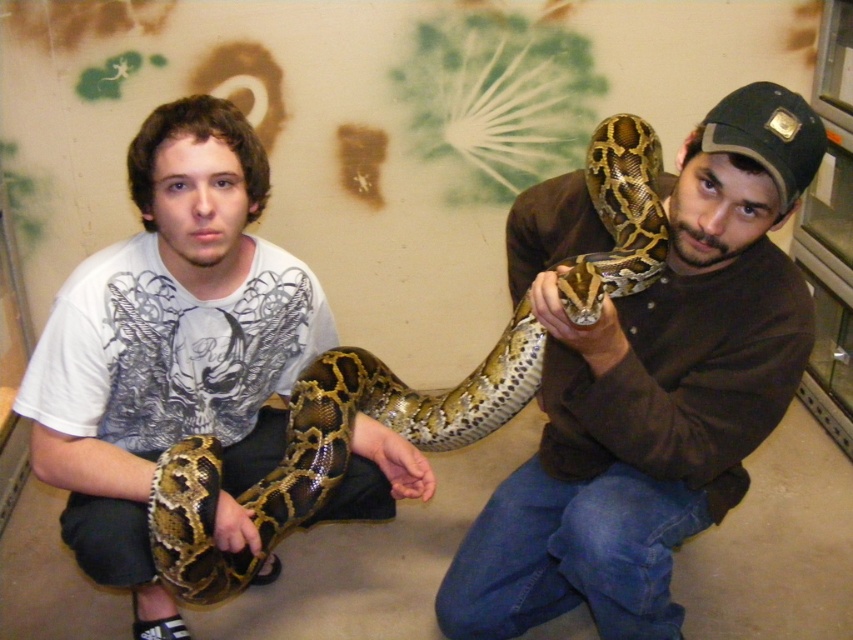
Is brown leather jacket at center thinner than shiny brown snake at center?

Yes.

Is point (627, 560) farther from viewer compared to point (200, 509)?

Yes.

Locate an element on the screen. brown leather jacket at center is located at coordinates (646, 385).

Which is in front, point (682, 240) or point (80, 269)?

Point (682, 240) is in front.

Is brown leather jacket at center bigger than white printed t-shirt at center?

Correct, brown leather jacket at center is larger in size than white printed t-shirt at center.

Is point (697, 224) positioned before point (207, 422)?

Yes.

This screenshot has width=853, height=640. Identify the location of brown leather jacket at center. (646, 385).

Does white printed t-shirt at center appear on the right side of shiny brown snake at center?

Incorrect, white printed t-shirt at center is not on the right side of shiny brown snake at center.

Is point (64, 452) positioned before point (392, 408)?

Yes, it is.

Where is `white printed t-shirt at center`? The image size is (853, 640). white printed t-shirt at center is located at coordinates (x=171, y=349).